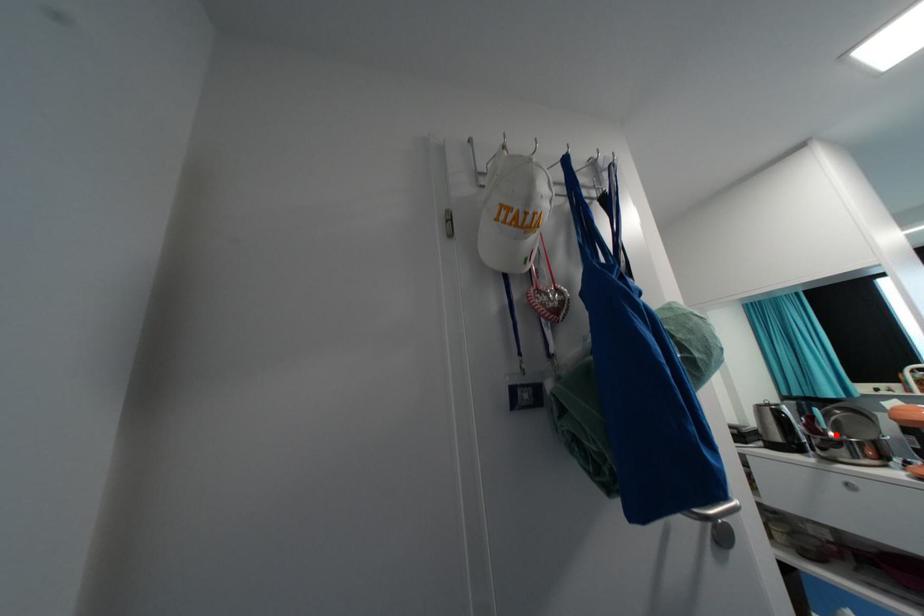
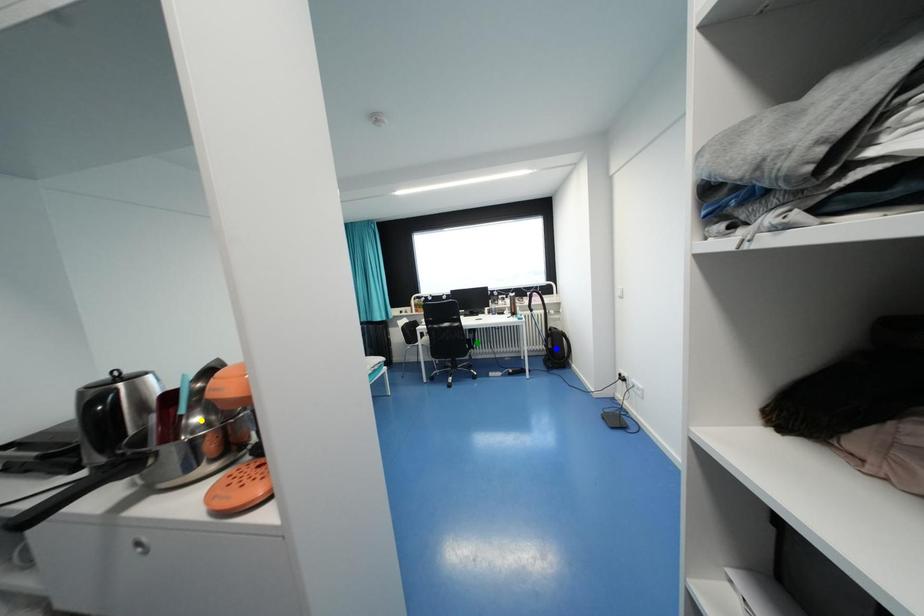
Question: I am providing you with two images of the same scene from different viewpoints. A red point is marked on the first image. You are given multiple points on the second image. Which point in image 2 is actually the same real-world point as the red point in image 1?

Choices:
 (A) yellow point
 (B) blue point
 (C) green point

Answer: (A)